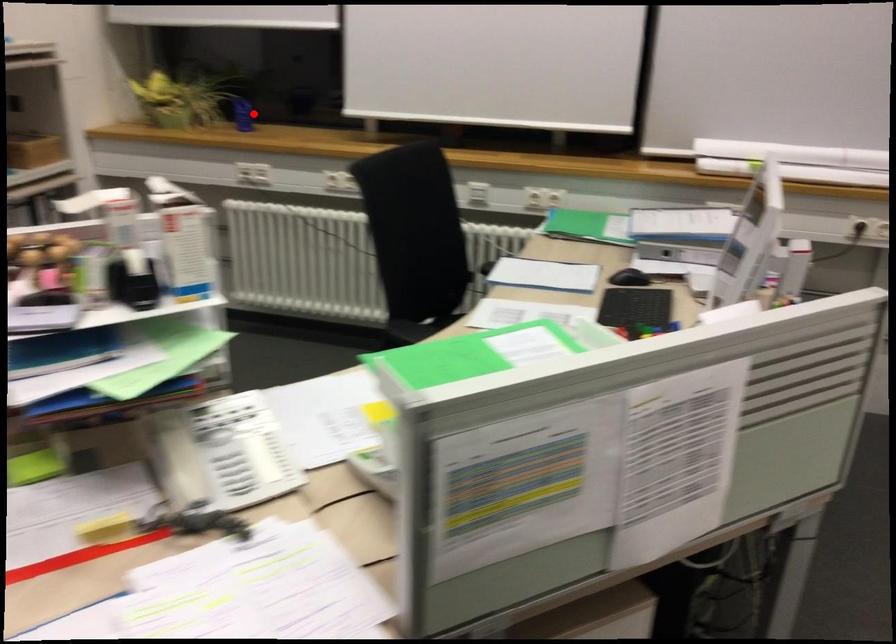
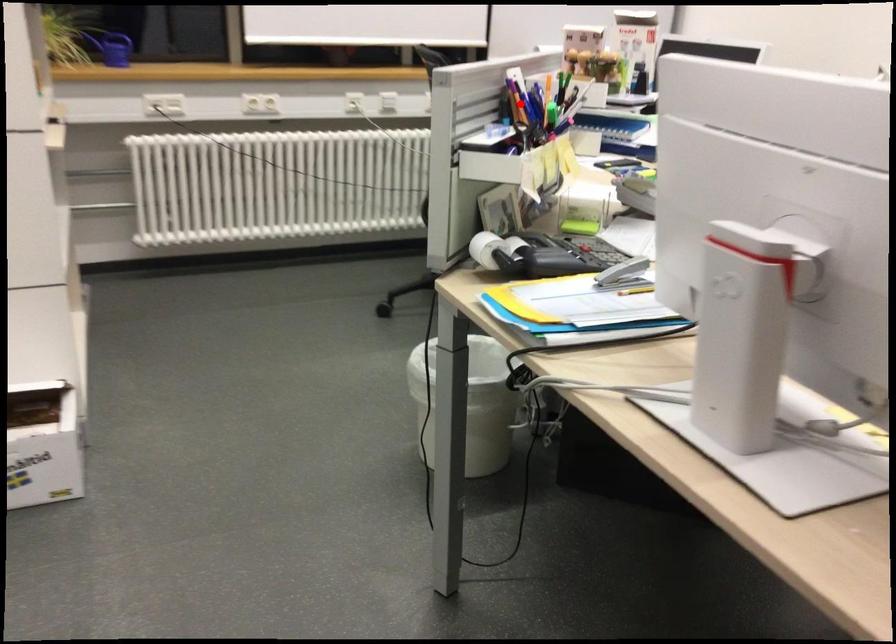
I am providing you with two images of the same scene from different viewpoints. A red point is marked on the first image and another point is marked on the second image. Is the marked point in image1 the same physical position as the marked point in image2?

No